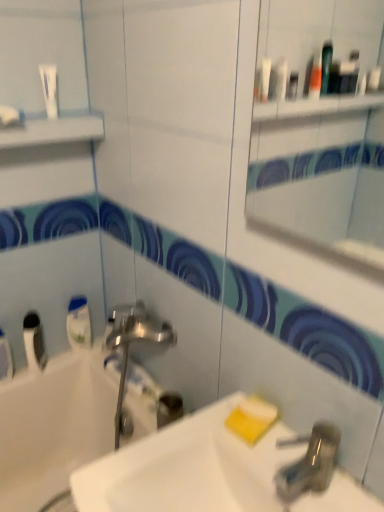
Find the location of a particular element. yellow sponge at lower center, which is the 2th soap from top to bottom is located at coordinates (252, 419).

Describe the element at coordinates (78, 323) in the screenshot. I see `white glossy mouthwash at left, the second mouthwash when ordered from left to right` at that location.

What do you see at coordinates (49, 88) in the screenshot? I see `white glossy tube at upper left` at bounding box center [49, 88].

You are a GUI agent. You are given a task and a screenshot of the screen. Output one action in this format:
    pyautogui.click(x=<x>, y=<y>)
    Task: Click on the yellow sponge at lower center, which is the 2th soap from top to bottom
    The width and height of the screenshot is (384, 512).
    Given the screenshot: What is the action you would take?
    pyautogui.click(x=252, y=419)

Considering the relative sizes of metallic faucet at lower right and white glossy sink at center in the image provided, is metallic faucet at lower right thinner than white glossy sink at center?

Correct, the width of metallic faucet at lower right is less than that of white glossy sink at center.

Would you consider metallic faucet at lower right to be distant from white glossy sink at center?

That's not correct — metallic faucet at lower right is a little close to white glossy sink at center.

Does point (316, 440) come behind point (272, 469)?

No.

Is metallic faucet at lower right to the left or to the right of white glossy sink at center in the image?

metallic faucet at lower right is positioned on white glossy sink at center's right side.

Where is `soap on the left of yellow matte soap at lower right, placed as the first soap when sorted from top to bottom`? The width and height of the screenshot is (384, 512). soap on the left of yellow matte soap at lower right, placed as the first soap when sorted from top to bottom is located at coordinates (252, 419).

Which is more to the left, yellow matte soap at lower right, placed as the first soap when sorted from top to bottom, or yellow sponge at lower center, which ranks as the 1th soap in bottom-to-top order?

yellow sponge at lower center, which ranks as the 1th soap in bottom-to-top order.

Based on their sizes in the image, would you say yellow matte soap at lower right, which is counted as the 2th soap, starting from the bottom, is bigger or smaller than yellow sponge at lower center, which ranks as the 1th soap in bottom-to-top order?

In the image, yellow matte soap at lower right, which is counted as the 2th soap, starting from the bottom, appears to be smaller than yellow sponge at lower center, which ranks as the 1th soap in bottom-to-top order.

Between yellow matte soap at lower right, placed as the first soap when sorted from top to bottom, and yellow sponge at lower center, which is the 2th soap from top to bottom, which one has smaller width?

yellow matte soap at lower right, placed as the first soap when sorted from top to bottom.

Considering the positions of objects white glossy bathtub at lower left and white opaque tube at lower left, which appears as the second mouthwash when viewed from the right, in the image provided, who is in front, white glossy bathtub at lower left or white opaque tube at lower left, which appears as the second mouthwash when viewed from the right,?

white glossy bathtub at lower left is in front.

How many degrees apart are the facing directions of white glossy bathtub at lower left and white opaque tube at lower left, which appears as the second mouthwash when viewed from the right?

white glossy bathtub at lower left and white opaque tube at lower left, which appears as the second mouthwash when viewed from the right, are facing 36.2 degrees away from each other.

Does white glossy bathtub at lower left have a greater width compared to white opaque tube at lower left, arranged as the 1th mouthwash when viewed from the left?

Yes.

Would you say white glossy bathtub at lower left is a long distance from white opaque tube at lower left, which appears as the second mouthwash when viewed from the right?

No.

Based on the photo, in terms of height, does white opaque tube at lower left, arranged as the 1th mouthwash when viewed from the left, look taller or shorter compared to metallic faucet at lower right?

white opaque tube at lower left, arranged as the 1th mouthwash when viewed from the left, is taller than metallic faucet at lower right.

Looking at this image, from a real-world perspective, is white opaque tube at lower left, which appears as the second mouthwash when viewed from the right, on top of metallic faucet at lower right?

No, from a real-world perspective, white opaque tube at lower left, which appears as the second mouthwash when viewed from the right, is not over metallic faucet at lower right

Is white opaque tube at lower left, which appears as the second mouthwash when viewed from the right, spatially inside metallic faucet at lower right, or outside of it?

white opaque tube at lower left, which appears as the second mouthwash when viewed from the right, lies outside metallic faucet at lower right.

Starting from the metallic faucet at lower right, which mouthwash is the 2nd one to the left? Please provide its 2D coordinates.

[(34, 342)]

From the image's perspective, which is below, yellow sponge at lower center, which is the 2th soap from top to bottom, or white glossy bathtub at lower left?

white glossy bathtub at lower left appears lower in the image.

Considering the sizes of yellow sponge at lower center, which ranks as the 1th soap in bottom-to-top order, and white glossy bathtub at lower left in the image, is yellow sponge at lower center, which ranks as the 1th soap in bottom-to-top order, taller or shorter than white glossy bathtub at lower left?

yellow sponge at lower center, which ranks as the 1th soap in bottom-to-top order, is shorter than white glossy bathtub at lower left.

From a real-world perspective, who is located higher, yellow sponge at lower center, which is the 2th soap from top to bottom, or white glossy bathtub at lower left?

yellow sponge at lower center, which is the 2th soap from top to bottom, is physically above.

Is metallic faucet at lower right at the back of white glossy mouthwash at left, the 1th mouthwash in the right-to-left sequence?

→ No, white glossy mouthwash at left, the 1th mouthwash in the right-to-left sequence, is not facing the opposite direction of metallic faucet at lower right.

Considering the sizes of objects white glossy mouthwash at left, the 1th mouthwash in the right-to-left sequence, and metallic faucet at lower right in the image provided, who is bigger, white glossy mouthwash at left, the 1th mouthwash in the right-to-left sequence, or metallic faucet at lower right?

metallic faucet at lower right.

Between white glossy mouthwash at left, the 1th mouthwash in the right-to-left sequence, and metallic faucet at lower right, which one is positioned in front?

Positioned in front is metallic faucet at lower right.

Considering the positions of objects white glossy sink at center and yellow sponge at lower center, which ranks as the 1th soap in bottom-to-top order, in the image provided, who is more to the right, white glossy sink at center or yellow sponge at lower center, which ranks as the 1th soap in bottom-to-top order,?

yellow sponge at lower center, which ranks as the 1th soap in bottom-to-top order, is more to the right.

Considering the relative sizes of white glossy sink at center and yellow sponge at lower center, which ranks as the 1th soap in bottom-to-top order, in the image provided, is white glossy sink at center bigger than yellow sponge at lower center, which ranks as the 1th soap in bottom-to-top order,?

Indeed, white glossy sink at center has a larger size compared to yellow sponge at lower center, which ranks as the 1th soap in bottom-to-top order.

How many degrees apart are the facing directions of white glossy sink at center and yellow sponge at lower center, which is the 2th soap from top to bottom?

The facing directions of white glossy sink at center and yellow sponge at lower center, which is the 2th soap from top to bottom, are 6.61 degrees apart.

Which is in front, white glossy sink at center or yellow sponge at lower center, which ranks as the 1th soap in bottom-to-top order?

white glossy sink at center is more forward.

The image size is (384, 512). In order to click on tap above the white glossy sink at center (from a real-world perspective) in this screenshot , I will do `click(311, 464)`.

Locate an element on the screen. soap in front of the yellow matte soap at lower right, which is counted as the 2th soap, starting from the bottom is located at coordinates (252, 419).

Estimate the real-world distances between objects in this image. Which object is closer to white glossy bathtub at lower left, metallic faucet at lower right or yellow matte soap at lower right, which is counted as the 2th soap, starting from the bottom?

Based on the image, yellow matte soap at lower right, which is counted as the 2th soap, starting from the bottom, appears to be nearer to white glossy bathtub at lower left.

In the scene shown: When comparing their distances from white glossy bathtub at lower left, does yellow sponge at lower center, which is the 2th soap from top to bottom, or white opaque tube at lower left, arranged as the 1th mouthwash when viewed from the left, seem closer?

Based on the image, white opaque tube at lower left, arranged as the 1th mouthwash when viewed from the left, appears to be nearer to white glossy bathtub at lower left.

When comparing their distances from yellow matte soap at lower right, placed as the first soap when sorted from top to bottom, does white glossy mouthwash at left, the second mouthwash when ordered from left to right, or white opaque tube at lower left, arranged as the 1th mouthwash when viewed from the left, seem further?

white opaque tube at lower left, arranged as the 1th mouthwash when viewed from the left.

From the image, which object appears to be farther from white opaque tube at lower left, arranged as the 1th mouthwash when viewed from the left, white glossy sink at center or metallic faucet at lower right?

metallic faucet at lower right lies further to white opaque tube at lower left, arranged as the 1th mouthwash when viewed from the left, than the other object.

Looking at the image, which one is located closer to white glossy tube at upper left, white glossy sink at center or metallic faucet at lower right?

white glossy sink at center is closer to white glossy tube at upper left.

Estimate the real-world distances between objects in this image. Which object is closer to white opaque tube at lower left, which appears as the second mouthwash when viewed from the right, yellow sponge at lower center, which ranks as the 1th soap in bottom-to-top order, or white glossy bathtub at lower left?

Among the two, white glossy bathtub at lower left is located nearer to white opaque tube at lower left, which appears as the second mouthwash when viewed from the right.

Based on their spatial positions, is white opaque tube at lower left, arranged as the 1th mouthwash when viewed from the left, or yellow matte soap at lower right, placed as the first soap when sorted from top to bottom, closer to white glossy tube at upper left?

white opaque tube at lower left, arranged as the 1th mouthwash when viewed from the left, lies closer to white glossy tube at upper left than the other object.

Consider the image. Estimate the real-world distances between objects in this image. Which object is closer to metallic faucet at lower right, white opaque tube at lower left, arranged as the 1th mouthwash when viewed from the left, or white glossy tube at upper left?

Among the two, white opaque tube at lower left, arranged as the 1th mouthwash when viewed from the left, is located nearer to metallic faucet at lower right.

Locate an element on the screen. The height and width of the screenshot is (512, 384). mouthwash located between metallic faucet at lower right and white glossy mouthwash at left, the 1th mouthwash in the right-to-left sequence, in the depth direction is located at coordinates (34, 342).

Where is `bathtub located between white opaque tube at lower left, arranged as the 1th mouthwash when viewed from the left, and yellow matte soap at lower right, placed as the first soap when sorted from top to bottom, in the left-right direction`? This screenshot has height=512, width=384. bathtub located between white opaque tube at lower left, arranged as the 1th mouthwash when viewed from the left, and yellow matte soap at lower right, placed as the first soap when sorted from top to bottom, in the left-right direction is located at coordinates pyautogui.click(x=72, y=412).

The width and height of the screenshot is (384, 512). I want to click on sink between white glossy bathtub at lower left and yellow matte soap at lower right, placed as the first soap when sorted from top to bottom, in the horizontal direction, so click(x=188, y=469).

At what (x,y) coordinates should I click in order to perform the action: click on bathtub located between white glossy sink at center and white opaque tube at lower left, arranged as the 1th mouthwash when viewed from the left, in the depth direction. Please return your answer as a coordinate pair (x, y). This screenshot has height=512, width=384. Looking at the image, I should click on (72, 412).